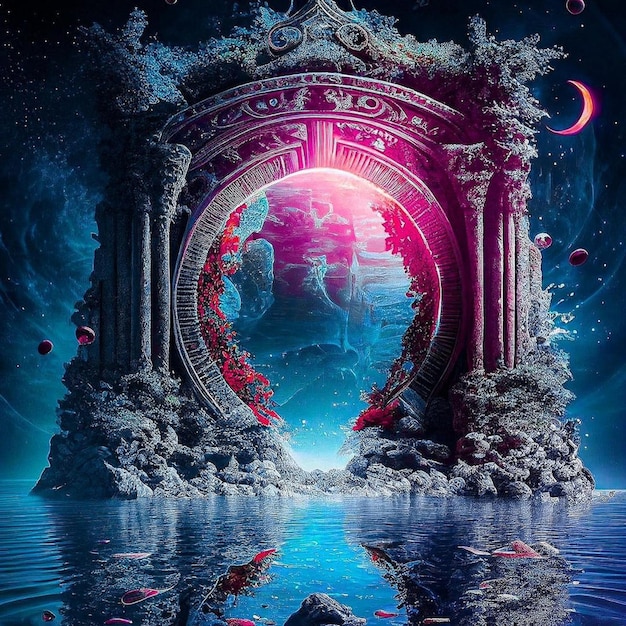
Find the location of `pillar to the left of arch`. pillar to the left of arch is located at coordinates (151, 254).